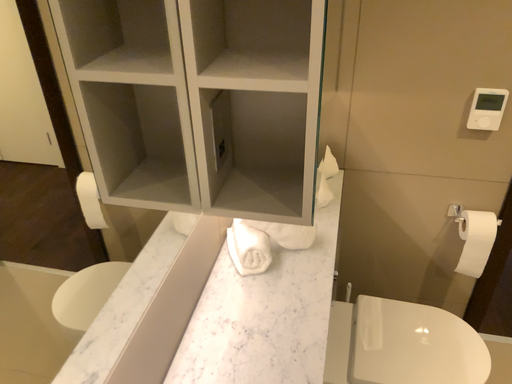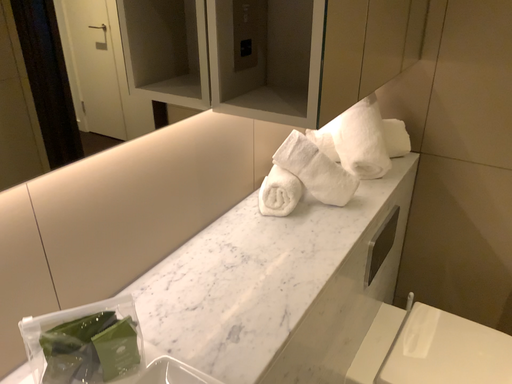
Question: Which way did the camera rotate in the video?

Choices:
 (A) rotated left
 (B) rotated right

Answer: (A)